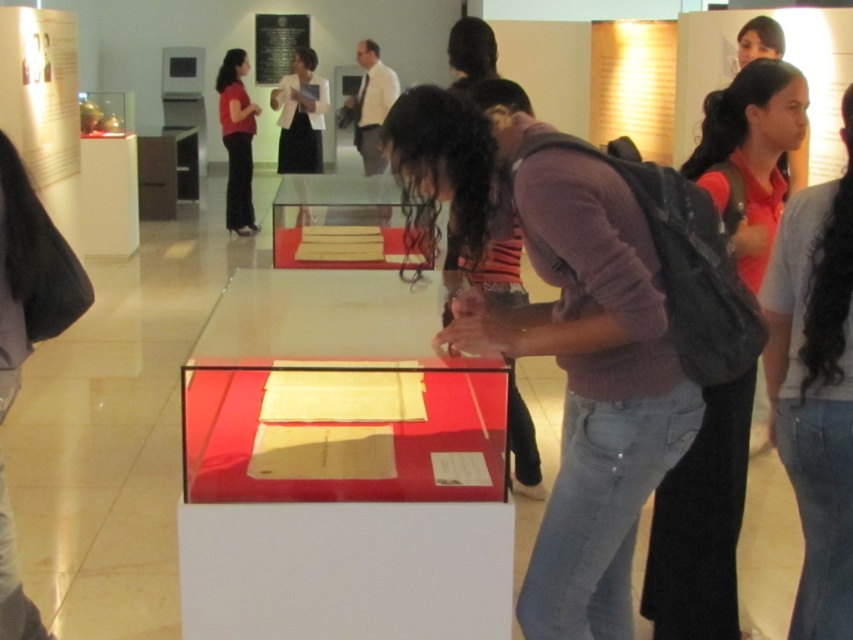
You are standing in the museum and want to take a photo of the red shirt at center. Where should you position yourself to capture it in the frame?

You should position yourself facing the red shirt at center located at point (701,524) to capture it in the frame.

You are an event organizer planning to place two signs next to the red shirt at center and the matte gray shirt at right. Since you want the signs to be proportional to the shirts, which shirt should have the smaller sign?

The red shirt at center should have the smaller sign because it occupies less space than the matte gray shirt at right.